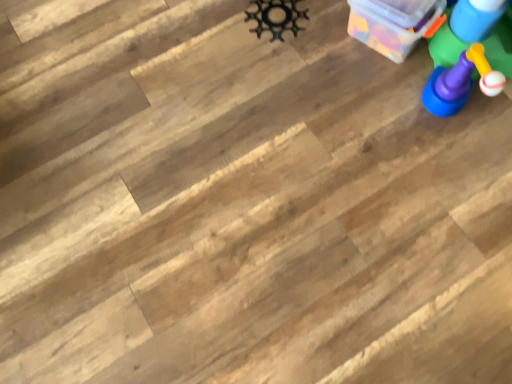
Question: From a real-world perspective, is blue plastic toy at upper right, marked as the first toy in a right-to-left arrangement, located higher than black metal gear at upper center, which is counted as the 1th toy, starting from the left?

Choices:
 (A) no
 (B) yes

Answer: (B)

Question: Considering the relative positions of blue plastic toy at upper right, the third toy when ordered from left to right, and black metal gear at upper center, the third toy from the right, in the image provided, is blue plastic toy at upper right, the third toy when ordered from left to right, to the left of black metal gear at upper center, the third toy from the right, from the viewer's perspective?

Choices:
 (A) no
 (B) yes

Answer: (A)

Question: Is blue plastic toy at upper right, the third toy when ordered from left to right, turned away from black metal gear at upper center, which is counted as the 1th toy, starting from the left?

Choices:
 (A) yes
 (B) no

Answer: (B)

Question: Is blue plastic toy at upper right, the third toy when ordered from left to right, far from black metal gear at upper center, which is counted as the 1th toy, starting from the left?

Choices:
 (A) yes
 (B) no

Answer: (B)

Question: From a real-world perspective, is blue plastic toy at upper right, marked as the first toy in a right-to-left arrangement, beneath black metal gear at upper center, the third toy from the right?

Choices:
 (A) no
 (B) yes

Answer: (A)

Question: Considering the relative sizes of blue plastic toy at upper right, the third toy when ordered from left to right, and black metal gear at upper center, which is counted as the 1th toy, starting from the left, in the image provided, is blue plastic toy at upper right, the third toy when ordered from left to right, shorter than black metal gear at upper center, which is counted as the 1th toy, starting from the left,?

Choices:
 (A) no
 (B) yes

Answer: (A)

Question: Is transparent plastic container at upper right next to black metal gear at upper center, the third toy from the right?

Choices:
 (A) yes
 (B) no

Answer: (B)

Question: Is transparent plastic container at upper right oriented towards black metal gear at upper center, which is counted as the 1th toy, starting from the left?

Choices:
 (A) no
 (B) yes

Answer: (A)

Question: Is black metal gear at upper center, the third toy from the right, at the back of transparent plastic container at upper right?

Choices:
 (A) yes
 (B) no

Answer: (B)

Question: Can you confirm if transparent plastic container at upper right is bigger than black metal gear at upper center, the third toy from the right?

Choices:
 (A) no
 (B) yes

Answer: (B)

Question: Is transparent plastic container at upper right wider than black metal gear at upper center, the third toy from the right?

Choices:
 (A) no
 (B) yes

Answer: (B)

Question: Is transparent plastic container at upper right to the right of black metal gear at upper center, the third toy from the right, from the viewer's perspective?

Choices:
 (A) no
 (B) yes

Answer: (B)

Question: Is black metal gear at upper center, the third toy from the right, wider than transparent plastic container at upper right?

Choices:
 (A) no
 (B) yes

Answer: (A)